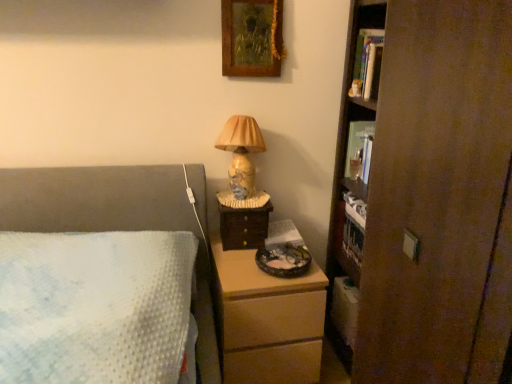
Question: Is hardcover book at upper right, which is counted as the 2th book, starting from the back, aimed at white plush cat at upper right?

Choices:
 (A) no
 (B) yes

Answer: (B)

Question: Are hardcover book at upper right, which is counted as the 2th book, starting from the back, and white plush cat at upper right beside each other?

Choices:
 (A) no
 (B) yes

Answer: (B)

Question: Considering the relative sizes of hardcover book at upper right, which is counted as the 2th book, starting from the back, and white plush cat at upper right in the image provided, is hardcover book at upper right, which is counted as the 2th book, starting from the back, thinner than white plush cat at upper right?

Choices:
 (A) yes
 (B) no

Answer: (B)

Question: Considering the relative sizes of hardcover book at upper right, which is counted as the 2th book, starting from the back, and white plush cat at upper right in the image provided, is hardcover book at upper right, which is counted as the 2th book, starting from the back, taller than white plush cat at upper right?

Choices:
 (A) yes
 (B) no

Answer: (A)

Question: From the image's perspective, would you say hardcover book at upper right, which is counted as the 2th book, starting from the back, is positioned over white plush cat at upper right?

Choices:
 (A) no
 (B) yes

Answer: (B)

Question: From the image's perspective, is hardcover book at upper right, which is counted as the first book, starting from the top, located beneath white plush cat at upper right?

Choices:
 (A) yes
 (B) no

Answer: (B)

Question: Does matte ceramic lamp at center have a greater width compared to white plush cat at upper right?

Choices:
 (A) yes
 (B) no

Answer: (A)

Question: From a real-world perspective, is matte ceramic lamp at center over white plush cat at upper right?

Choices:
 (A) no
 (B) yes

Answer: (A)

Question: Is matte ceramic lamp at center not inside white plush cat at upper right?

Choices:
 (A) yes
 (B) no

Answer: (A)

Question: Is the depth of matte ceramic lamp at center greater than that of white plush cat at upper right?

Choices:
 (A) yes
 (B) no

Answer: (B)

Question: From the image's perspective, is matte ceramic lamp at center located above white plush cat at upper right?

Choices:
 (A) yes
 (B) no

Answer: (B)

Question: Does matte ceramic lamp at center have a lesser height compared to white plush cat at upper right?

Choices:
 (A) no
 (B) yes

Answer: (A)

Question: Does wooden drawer at right come behind wooden chest of drawers at lower center?

Choices:
 (A) no
 (B) yes

Answer: (B)